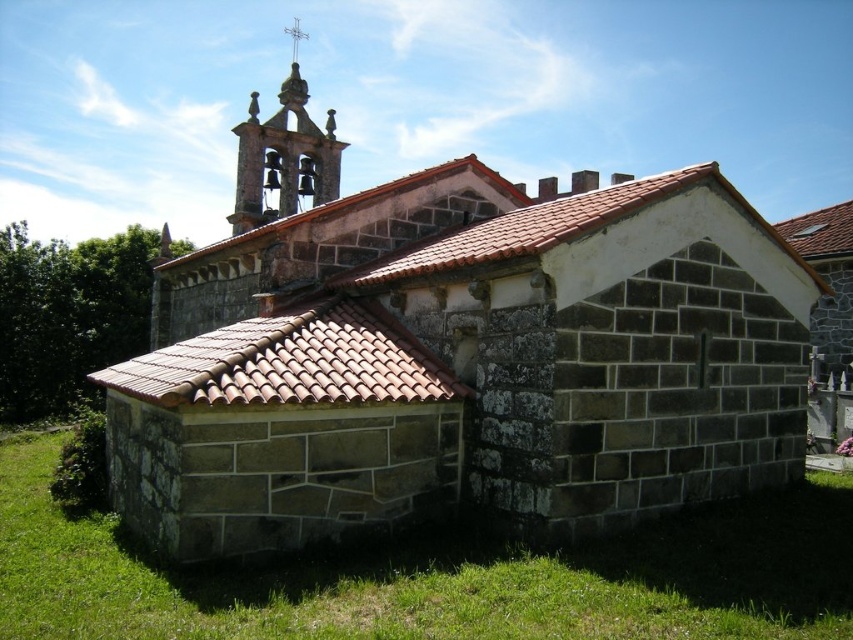
Question: Is green grass at lower center to the right of brown tile roof at lower left from the viewer's perspective?

Choices:
 (A) yes
 (B) no

Answer: (A)

Question: Is green grass at lower center smaller than brown tile roof at lower left?

Choices:
 (A) no
 (B) yes

Answer: (B)

Question: Among these points, which one is nearest to the camera?

Choices:
 (A) (363, 378)
 (B) (165, 614)
 (C) (653, 184)

Answer: (B)

Question: Which point is farther from the camera taking this photo?

Choices:
 (A) (297, 380)
 (B) (665, 518)
 (C) (624, 196)

Answer: (C)

Question: Is green grass at lower center to the right of brown tile roof at upper center from the viewer's perspective?

Choices:
 (A) no
 (B) yes

Answer: (A)

Question: Which of these objects is positioned farthest from the brown tile roof at lower left?

Choices:
 (A) brown tile roof at upper center
 (B) green grass at lower center

Answer: (B)